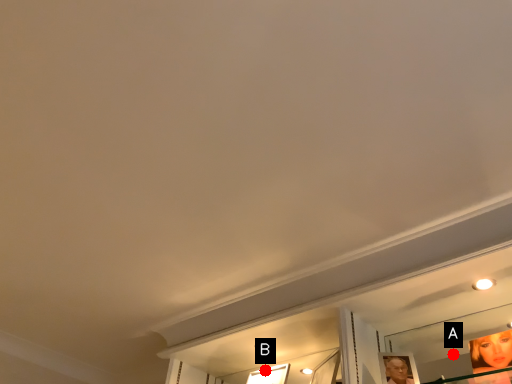
Question: Two points are circled on the image, labeled by A and B beside each circle. Which point appears closest to the camera in this image?

Choices:
 (A) A is closer
 (B) B is closer

Answer: (B)